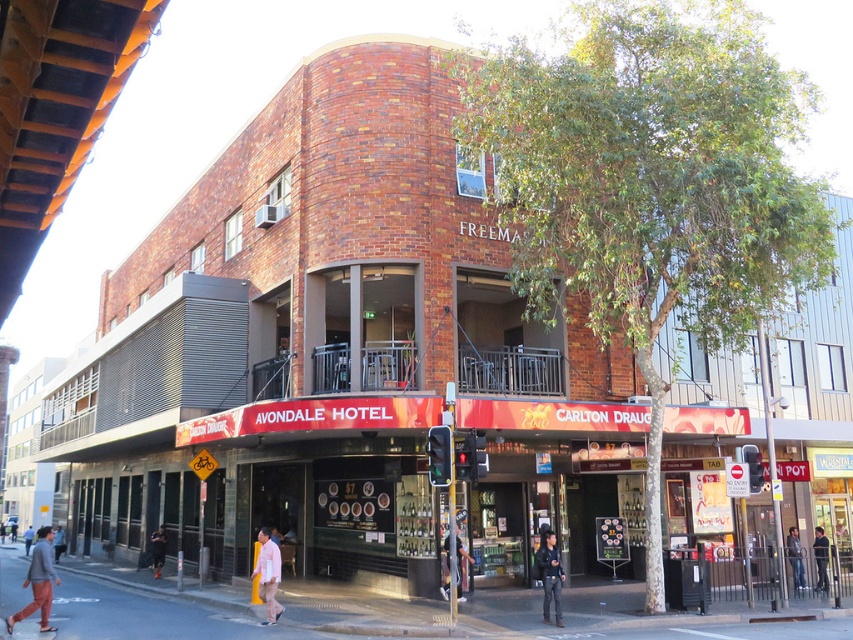
Question: Is pink fabric shirt at lower center smaller than dark blue uniform at center?

Choices:
 (A) no
 (B) yes

Answer: (B)

Question: Where is pink fabric shirt at lower center located in relation to denim jacket at lower right in the image?

Choices:
 (A) left
 (B) right

Answer: (A)

Question: Can you confirm if concrete pavement at lower center is positioned above denim jacket at lower right?

Choices:
 (A) yes
 (B) no

Answer: (B)

Question: Among these objects, which one is farthest from the camera?

Choices:
 (A) light blue jeans at lower left
 (B) light pink shirt at lower center

Answer: (B)

Question: Which of these objects is positioned farthest from the denim jacket at lower right?

Choices:
 (A) dark blue uniform at center
 (B) gray cotton pants at lower left
 (C) light pink shirt at lower center

Answer: (C)

Question: Which object is the closest to the dark blue uniform at center?

Choices:
 (A) dark gray pants at lower left
 (B) gray cotton pants at lower left

Answer: (B)